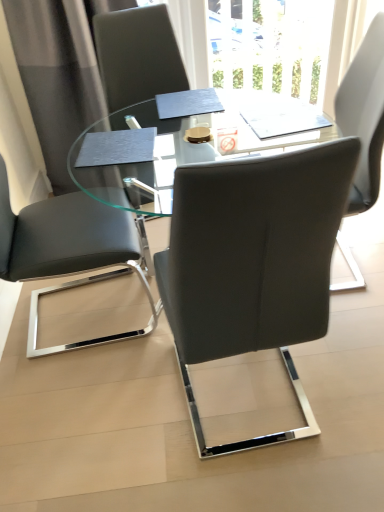
Find the location of `free point to the right of matte gray chair at center, which is the 1th chair from right to left`. free point to the right of matte gray chair at center, which is the 1th chair from right to left is located at coordinates (347, 374).